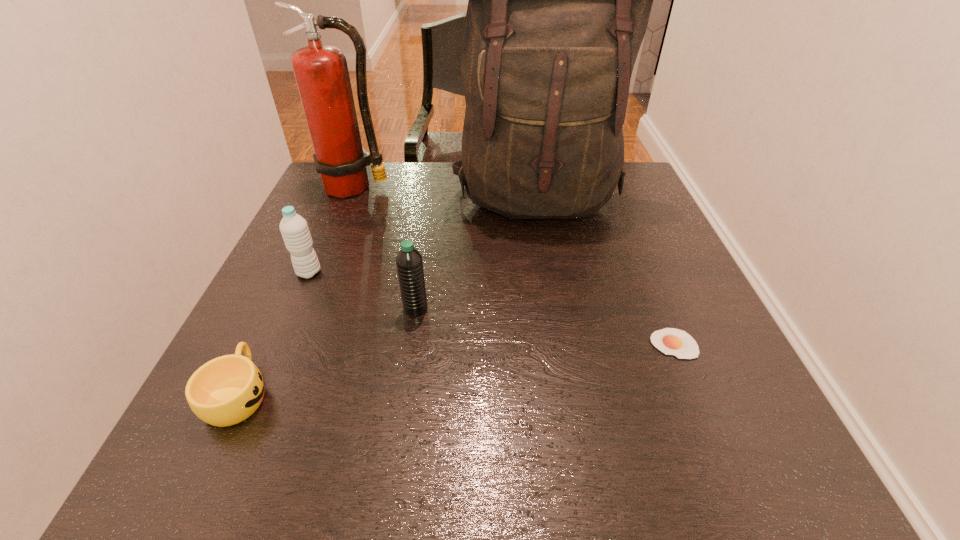
In order to click on vacant space that is in between the nearest object and the fifth shortest object in this screenshot , I will do `click(297, 291)`.

Where is `free space between the right water bottle and the second tallest object`? The image size is (960, 540). free space between the right water bottle and the second tallest object is located at coordinates (385, 248).

Find the location of a particular element. The image size is (960, 540). unoccupied position between the right water bottle and the tallest object is located at coordinates (476, 254).

This screenshot has height=540, width=960. I want to click on object that is the closest to the cup, so click(294, 229).

Select which object appears as the second closest to the second tallest object. Please provide its 2D coordinates. Your answer should be formatted as a tuple, i.e. [(x, y)], where the tuple contains the x and y coordinates of a point satisfying the conditions above.

[(294, 229)]

Locate an element on the screen. vacant space that satisfies the following two spatial constraints: 1. on the front side of the right water bottle; 2. on the right side of the fourth nearest object is located at coordinates (294, 308).

In order to click on free spot that satisfies the following two spatial constraints: 1. on the front side of the third nearest object; 2. on the left side of the egg yolk in this screenshot , I will do `click(410, 344)`.

The image size is (960, 540). I want to click on free space that satisfies the following two spatial constraints: 1. at the nozzle of the fire extinguisher; 2. on the left side of the third nearest object, so click(x=305, y=308).